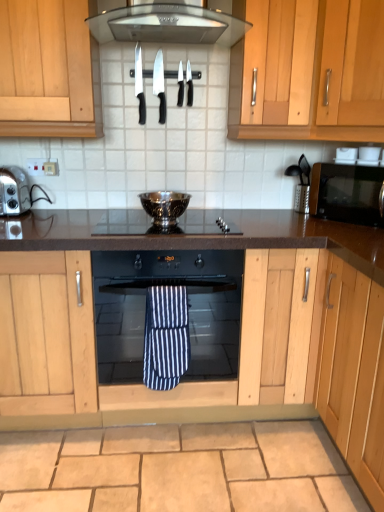
At what (x,y) coordinates should I click in order to perform the action: click on empty space that is ontop of beige stone granite at lower center (from a real-world perspective). Please return your answer as a coordinate pair (x, y). This screenshot has width=384, height=512. Looking at the image, I should click on (172, 461).